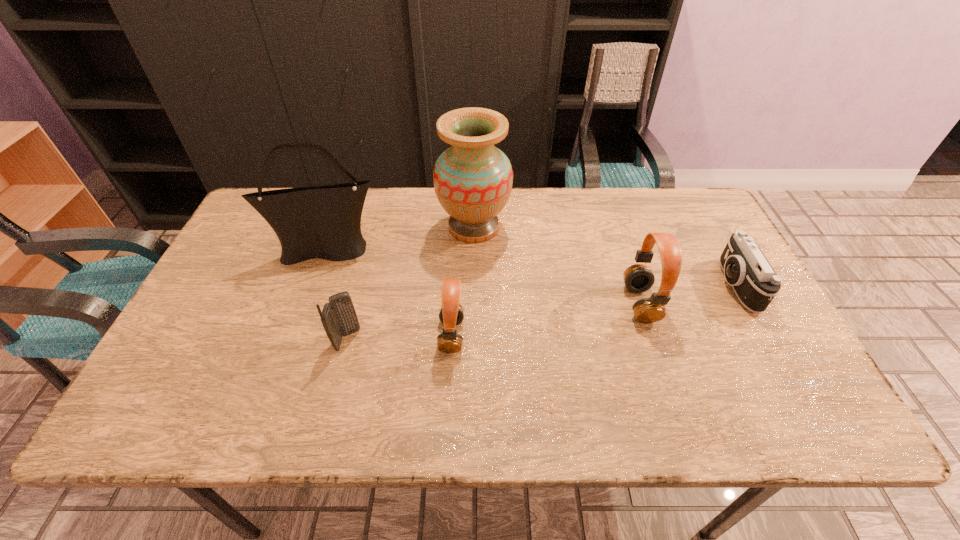
Please point a vacant point for placing a headset on the left. Please provide its 2D coordinates. Your answer should be formatted as a tuple, i.e. [(x, y)], where the tuple contains the x and y coordinates of a point satisfying the conditions above.

[(236, 372)]